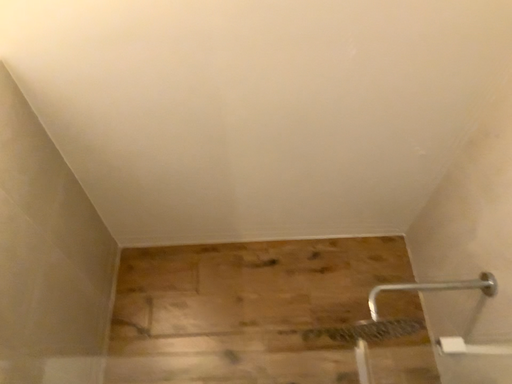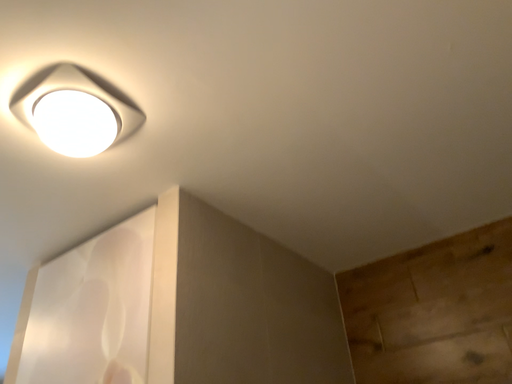
Question: Which way did the camera rotate in the video?

Choices:
 (A) rotated right
 (B) rotated left

Answer: (B)